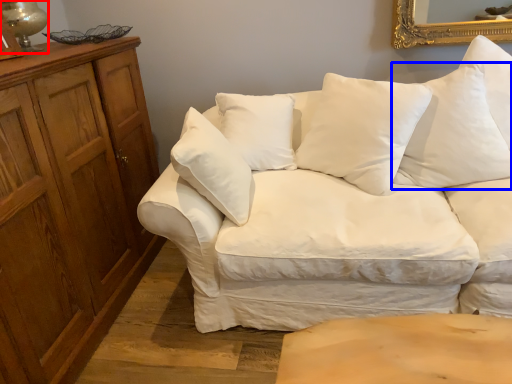
Question: Which object is further to the camera taking this photo, table lamp (highlighted by a red box) or pillow (highlighted by a blue box)?

Choices:
 (A) table lamp
 (B) pillow

Answer: (A)